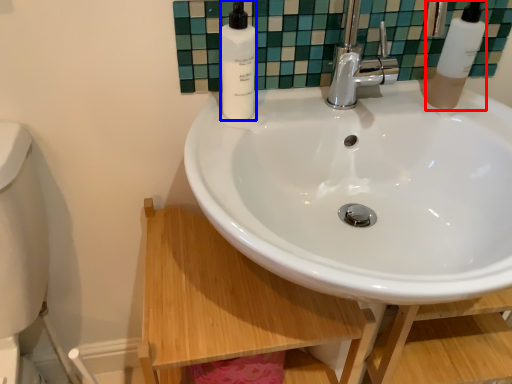
Question: Among these objects, which one is nearest to the camera, soap dispenser (highlighted by a red box) or soap dispenser (highlighted by a blue box)?

Choices:
 (A) soap dispenser
 (B) soap dispenser

Answer: (B)